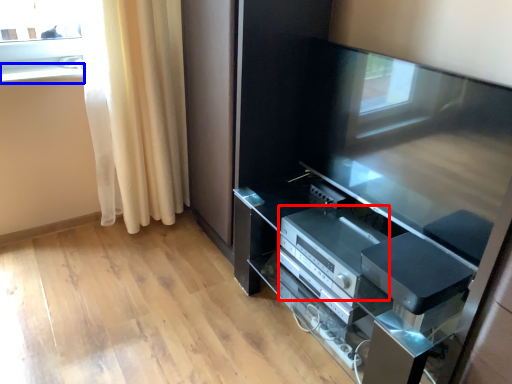
Question: Among these objects, which one is nearest to the camera, appliance (highlighted by a red box) or window sill (highlighted by a blue box)?

Choices:
 (A) appliance
 (B) window sill

Answer: (A)